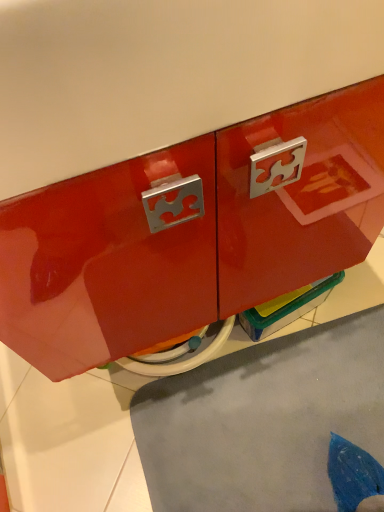
This screenshot has width=384, height=512. Find the location of `glossy plastic cabinet at center`. glossy plastic cabinet at center is located at coordinates (189, 234).

Describe the element at coordinates (189, 234) in the screenshot. I see `glossy plastic cabinet at center` at that location.

At what (x,y) coordinates should I click in order to perform the action: click on glossy plastic cabinet at center. Please return your answer as a coordinate pair (x, y). This screenshot has height=512, width=384. Looking at the image, I should click on (189, 234).